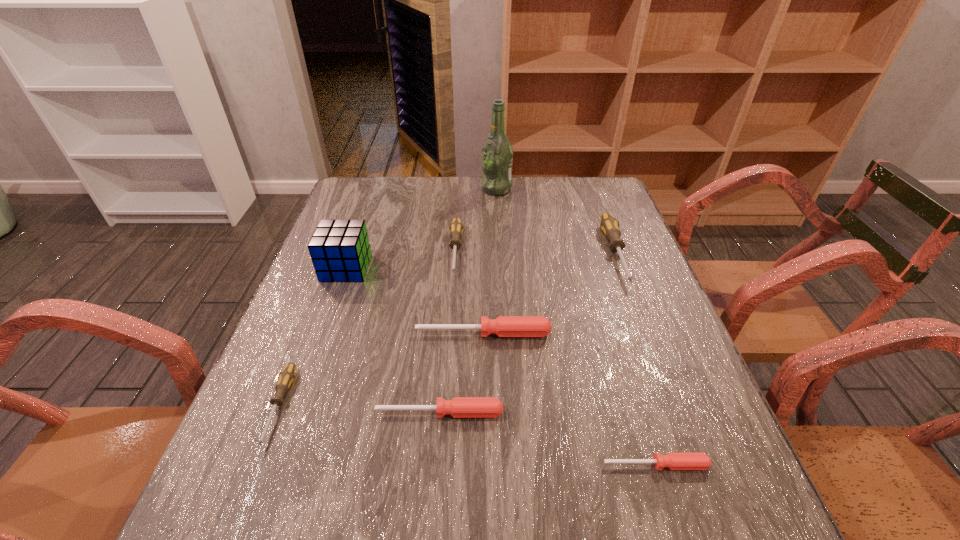
Where is `vacant space that's between the cube and the nearest red screwdriver`? The image size is (960, 540). vacant space that's between the cube and the nearest red screwdriver is located at coordinates (501, 367).

At what (x,y) coordinates should I click in order to perform the action: click on free space between the second smallest gray screwdriver and the beer bottle. Please return your answer as a coordinate pair (x, y). Looking at the image, I should click on (476, 220).

Select which object is the sixth closest to the second biggest red screwdriver. Please provide its 2D coordinates. Your answer should be formatted as a tuple, i.e. [(x, y)], where the tuple contains the x and y coordinates of a point satisfying the conditions above.

[(609, 225)]

This screenshot has height=540, width=960. Find the location of `object that is the fifth closest one to the farthest red screwdriver`. object that is the fifth closest one to the farthest red screwdriver is located at coordinates click(x=286, y=377).

Find the location of a particular element. This screenshot has height=540, width=960. screwdriver that is the second closest to the biggest gray screwdriver is located at coordinates (456, 228).

This screenshot has width=960, height=540. I want to click on the second closest screwdriver relative to the second biggest gray screwdriver, so click(x=459, y=407).

Image resolution: width=960 pixels, height=540 pixels. Identify the location of the closest gray screwdriver to the red cube. (456, 228).

Find the location of `the third closest gray screwdriver relative to the nearest screwdriver`. the third closest gray screwdriver relative to the nearest screwdriver is located at coordinates (286, 377).

Where is `red screwdriver that is the third nearest to the second gray screwdriver from left to right`? This screenshot has height=540, width=960. red screwdriver that is the third nearest to the second gray screwdriver from left to right is located at coordinates (674, 461).

Find the location of `red screwdriver that stands as the second closest to the beer bottle`. red screwdriver that stands as the second closest to the beer bottle is located at coordinates (459, 407).